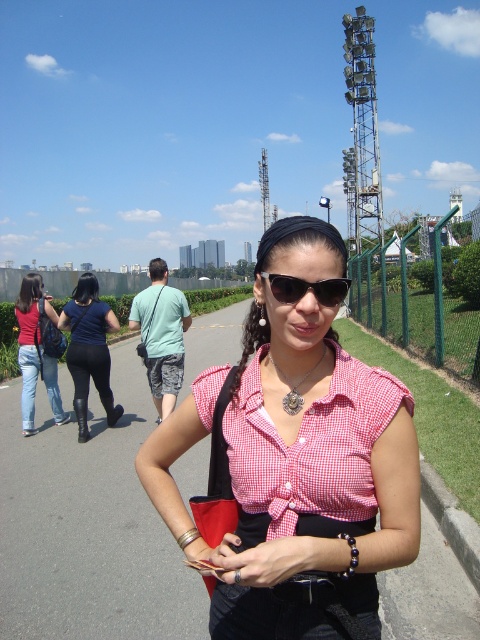
Measure the distance between pink checkered shirt at center and camera.

pink checkered shirt at center and camera are 1.14 meters apart.

Can you confirm if pink checkered shirt at center is shorter than sunglasses at center?

No.

What do you see at coordinates (297, 464) in the screenshot?
I see `pink checkered shirt at center` at bounding box center [297, 464].

The width and height of the screenshot is (480, 640). I want to click on pink checkered shirt at center, so click(297, 464).

Does pink checkered shirt at center appear on the right side of denim jeans at left?

Correct, you'll find pink checkered shirt at center to the right of denim jeans at left.

Between pink checkered shirt at center and denim jeans at left, which one is positioned higher?

denim jeans at left

Between point (252, 477) and point (33, 337), which one is positioned behind?

The point (33, 337) is more distant.

The width and height of the screenshot is (480, 640). Identify the location of pink checkered shirt at center. (297, 464).

Consider the image. Can you confirm if denim jeans at left is positioned below sunglasses at center?

Indeed, denim jeans at left is positioned under sunglasses at center.

Is denim jeans at left above sunglasses at center?

Incorrect, denim jeans at left is not positioned above sunglasses at center.

Locate an element on the screen. The height and width of the screenshot is (640, 480). denim jeans at left is located at coordinates (35, 355).